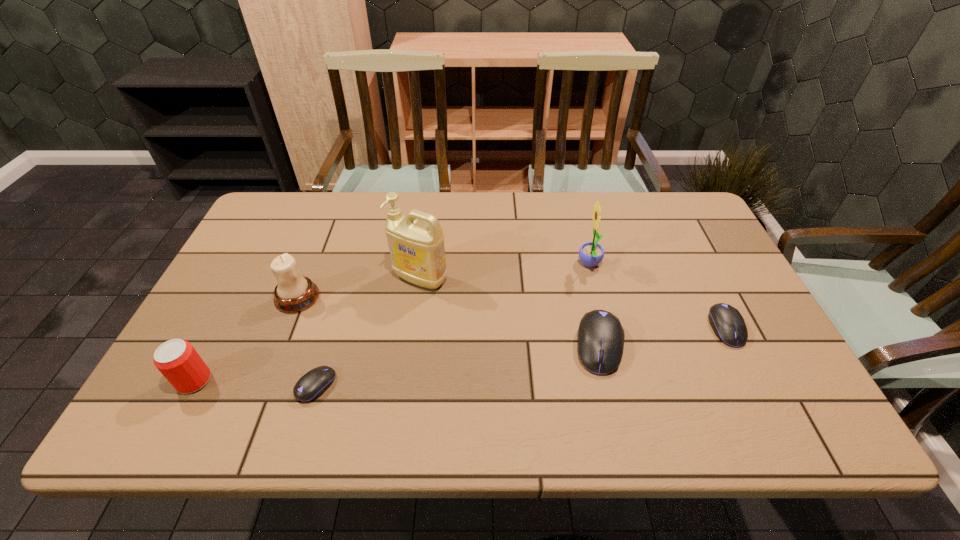
To achieve even spacing by inserting another mouse_(computer_equipment) among them, please point to a vacant spot for this new mouse_(computer_equipment). Please provide its 2D coordinates. Your answer should be formatted as a tuple, i.e. [(x, y)], where the tuple contains the x and y coordinates of a point satisfying the conditions above.

[(463, 365)]